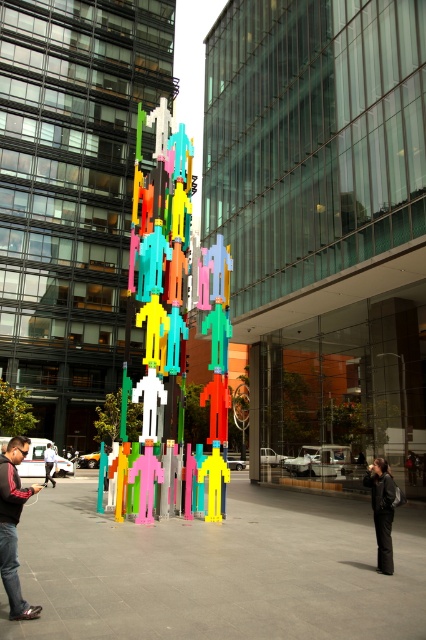
Question: Can you confirm if multicolored plastic figures at center is positioned above black leather jacket at lower left?

Choices:
 (A) yes
 (B) no

Answer: (A)

Question: Considering the relative positions of multicolored plastic figures at center and white plastic figure at center in the image provided, where is multicolored plastic figures at center located with respect to white plastic figure at center?

Choices:
 (A) below
 (B) above

Answer: (B)

Question: Estimate the real-world distances between objects in this image. Which object is closer to the multicolored plastic figures at center?

Choices:
 (A) black matte pants at lower right
 (B) white plastic figure at center
 (C) black leather jacket at lower left

Answer: (A)

Question: Among these objects, which one is farthest from the camera?

Choices:
 (A) black leather jacket at lower left
 (B) white plastic figure at center
 (C) multicolored plastic figures at center
 (D) black matte pants at lower right

Answer: (B)

Question: Which of the following is the closest to the observer?

Choices:
 (A) (157, 154)
 (B) (374, 470)
 (C) (49, 472)

Answer: (B)

Question: Does multicolored plastic figures at center lie in front of black matte pants at lower right?

Choices:
 (A) no
 (B) yes

Answer: (A)